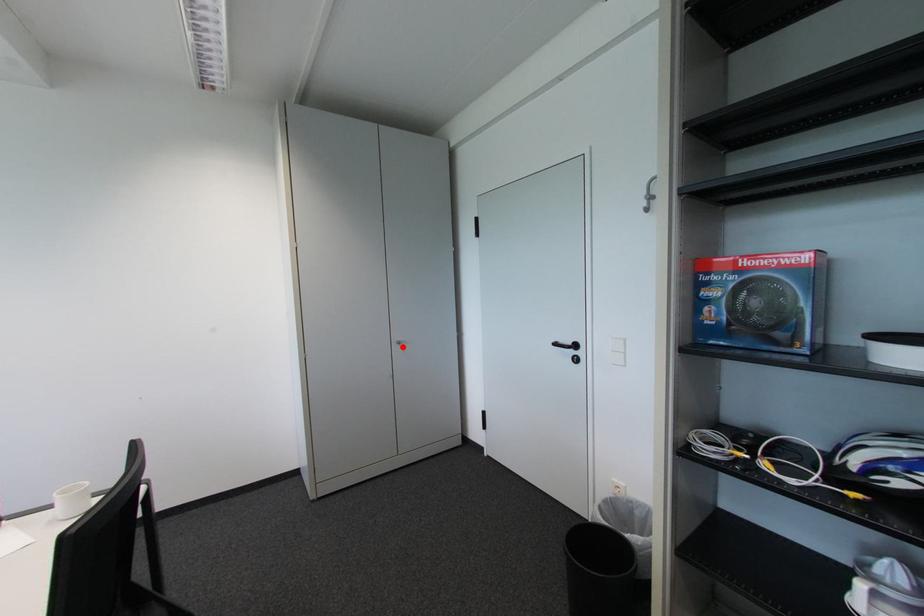
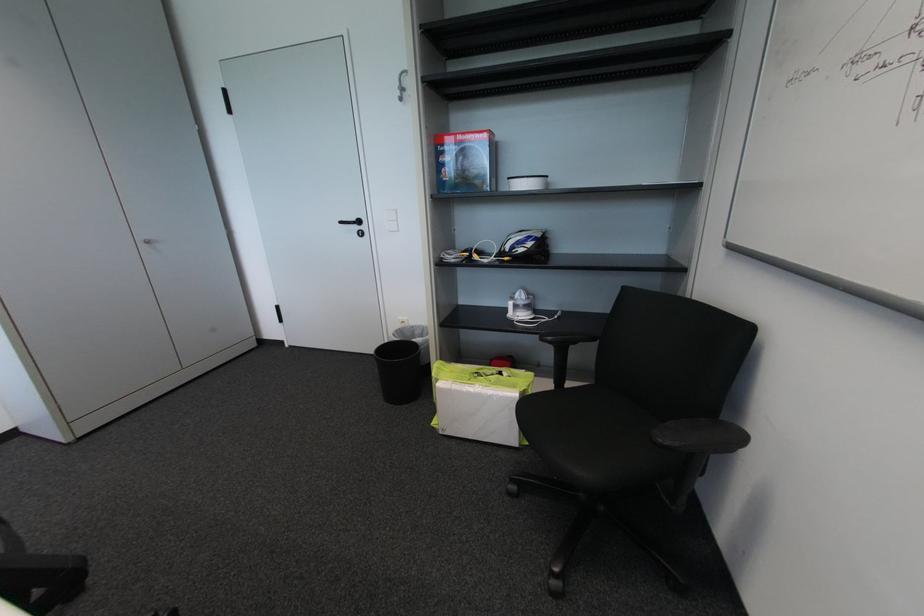
Locate, in the second image, the point that corresponds to the highlighted location in the first image.

(151, 246)